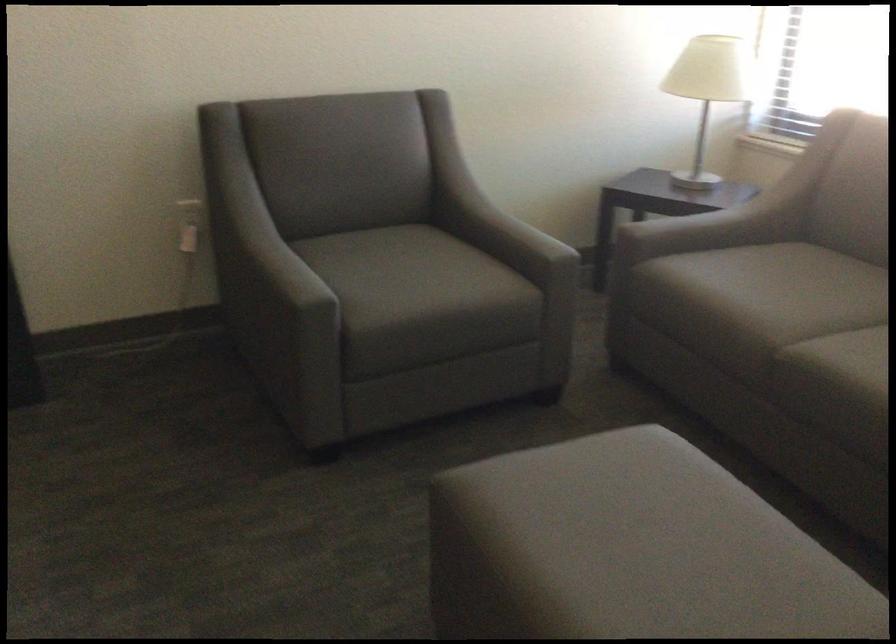
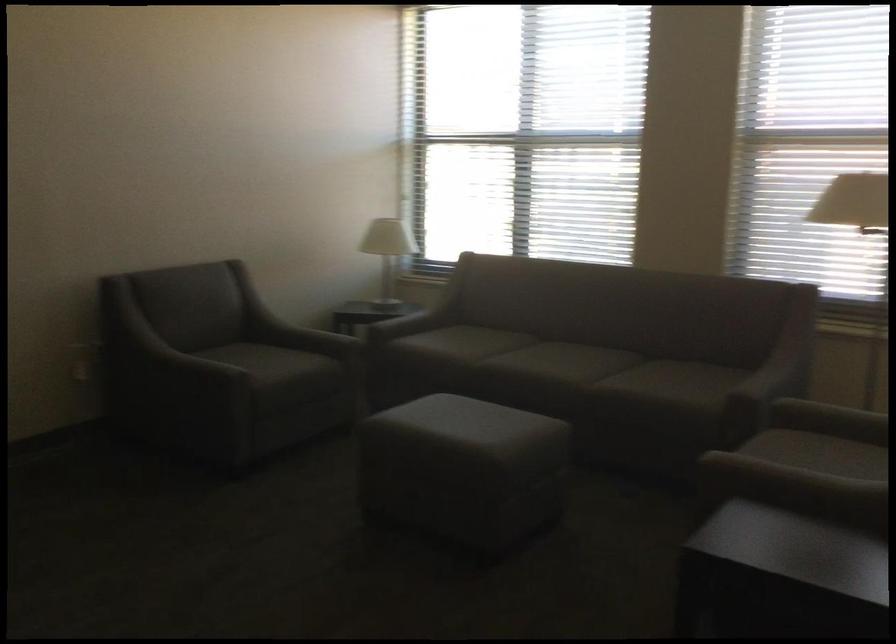
The point at (x=497, y=245) is marked in the first image. Where is the corresponding point in the second image?

(307, 339)